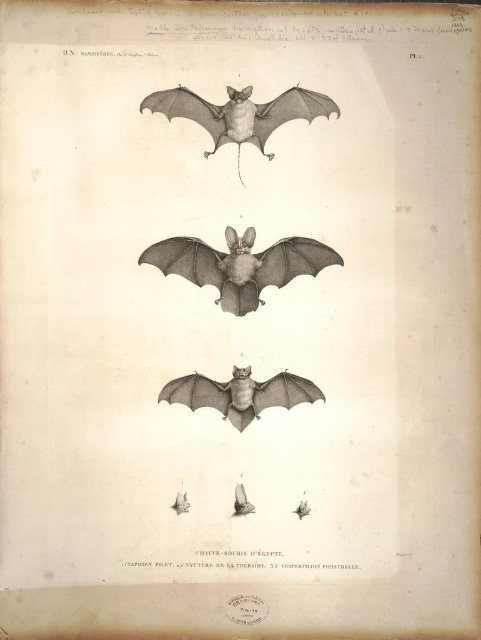
Question: Is matte black wing at center in front of gray ink bat at center?

Choices:
 (A) no
 (B) yes

Answer: (A)

Question: Which point is farther from the camera taking this photo?

Choices:
 (A) (241, 282)
 (B) (262, 394)

Answer: (A)

Question: Which point appears farthest from the camera in this image?

Choices:
 (A) (294, 385)
 (B) (180, 250)

Answer: (A)

Question: Does matte black wing at center appear under gray ink bat at center?

Choices:
 (A) yes
 (B) no

Answer: (B)

Question: Does matte black wing at center lie in front of gray ink bat at center?

Choices:
 (A) yes
 (B) no

Answer: (B)